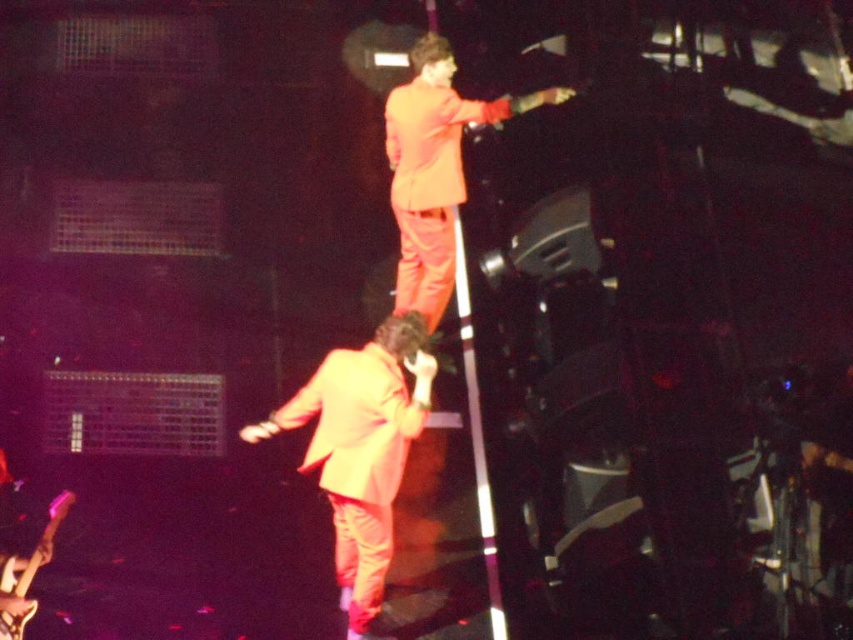
Question: Is orange matte suit at center positioned in front of orange matte suit at upper center?

Choices:
 (A) yes
 (B) no

Answer: (A)

Question: Does orange matte suit at center appear under orange matte suit at upper center?

Choices:
 (A) no
 (B) yes

Answer: (B)

Question: Which object is farther from the camera taking this photo?

Choices:
 (A) orange matte suit at upper center
 (B) orange matte suit at center

Answer: (A)

Question: Which of the following is the closest to the observer?

Choices:
 (A) orange matte suit at center
 (B) orange matte suit at upper center

Answer: (A)

Question: Can you confirm if orange matte suit at center is positioned to the left of orange matte suit at upper center?

Choices:
 (A) no
 (B) yes

Answer: (B)